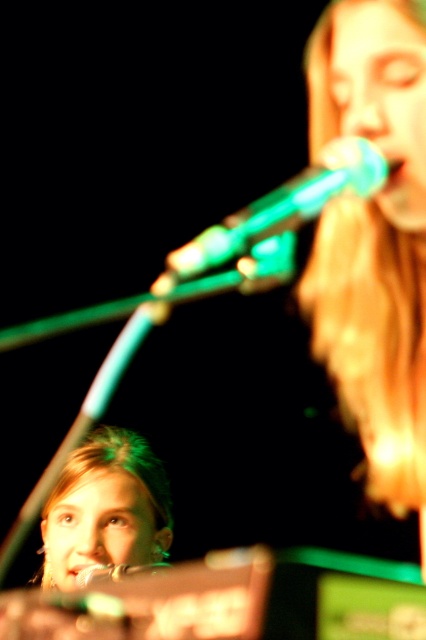
You are a stagehand setting up for a performance. You have to place a new microphone stand that must be taller than the shiny gold microphone at upper right. Given that the current stand is exactly the same height as the matte skin at center, will the current stand suffice?

The shiny gold microphone at upper right is bigger than the matte skin at center. Since the current stand is the same height as the matte skin at center, it is not tall enough for the new stand requirement which needs to be taller than the shiny gold microphone at upper right.

You are standing at the center of the stage and want to hand a gift to the performer holding the shiny gold microphone at upper right. Which direction should you move to reach them?

The shiny gold microphone at upper right is located at point (374, 241), so you should move towards the upper right direction to reach the performer holding it.

You are a stagehand adjusting the lighting for the performance. You notice the shiny gold microphone at upper right and the matte skin at center. Which object is positioned higher in the image?

The shiny gold microphone at upper right is positioned higher than the matte skin at center in the image.